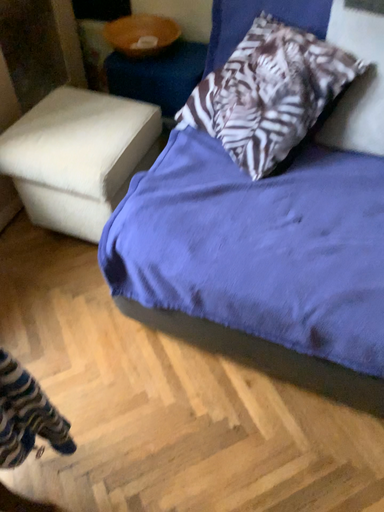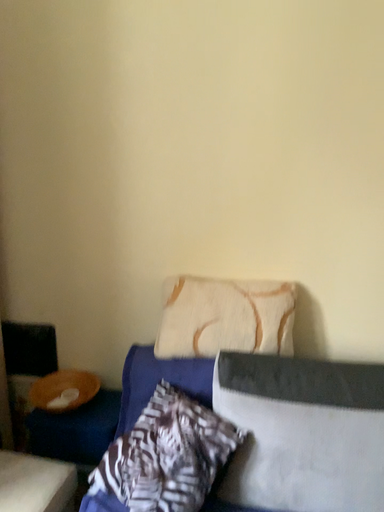
Question: How did the camera likely rotate when shooting the video?

Choices:
 (A) rotated downward
 (B) rotated upward

Answer: (B)